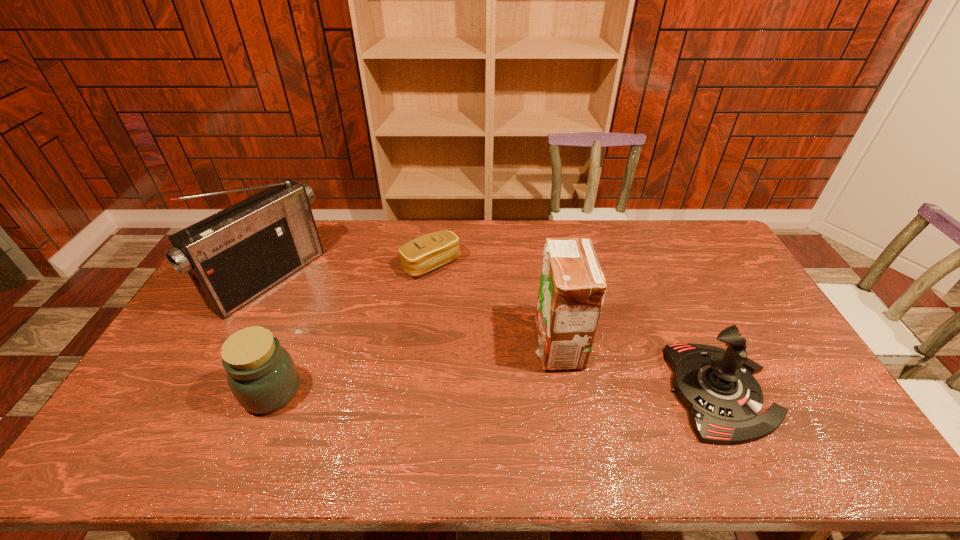
You are a GUI agent. You are given a task and a screenshot of the screen. Output one action in this format:
    pyautogui.click(x=<x>, y=<y>)
    Task: Click on the vacant space on the desktop that is between the fourth tallest object and the rightmost object and is positioned on the front-facing side of the tallest object
    Image resolution: width=960 pixels, height=540 pixels.
    Given the screenshot: What is the action you would take?
    pyautogui.click(x=448, y=392)

Locate an element on the screen. vacant spot on the desktop that is between the second shortest object and the rightmost object and is positioned on the straw side of the fourth object from left to right is located at coordinates (503, 392).

Find the location of a particular element. This screenshot has height=540, width=960. free space on the desktop that is between the jar and the joystick and is positioned on the zipper side of the third object from left to right is located at coordinates (542, 392).